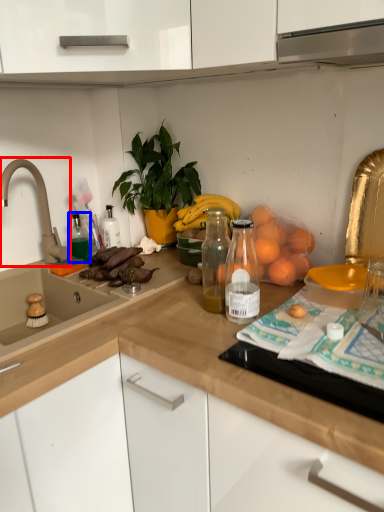
Question: Which of the following is the farthest to the observer, tap (highlighted by a red box) or bottle (highlighted by a blue box)?

Choices:
 (A) tap
 (B) bottle

Answer: (B)